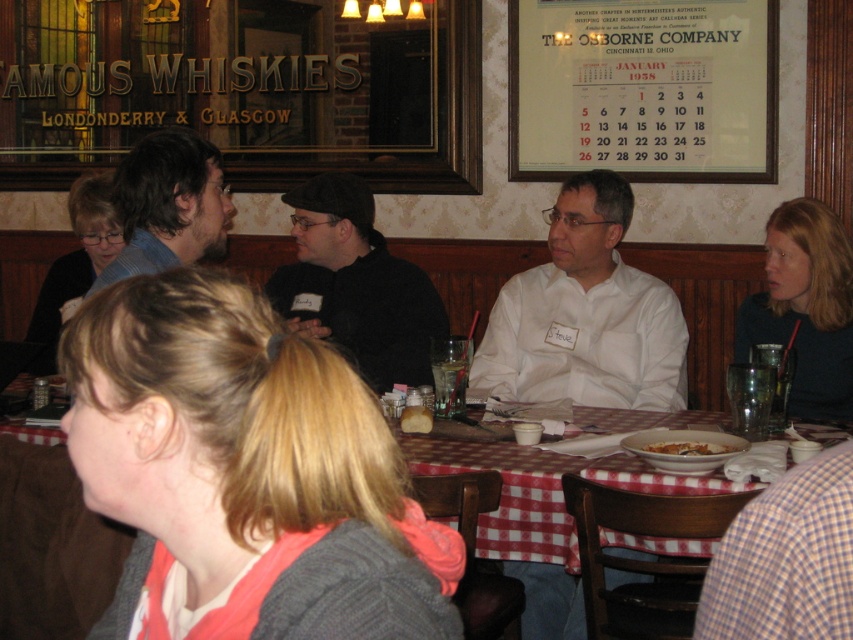
You are a server at the restaurant and need to deliver a drink to the customer with blonde hair at center. The table with red checkered tablecloth at center is between you and the customer. Can you reach the customer without moving the table?

The distance between the blonde hair at center and the red checkered tablecloth at center is 4.39 feet. Since the table is in the way, you would need to move around it or the table to reach the customer.

Based on the scene description, which object occupies more space in the image? The blonde hair at center or the red checkered tablecloth at center?

The red checkered tablecloth at center occupies more space in the image than the blonde hair at center.

You are a server at the restaurant and need to deliver a small appetizer plate to the table. The plate can only be placed between the white shirt at center and the black matte shirt at center. Is there enough space between them to place the plate?

The white shirt at center and the black matte shirt at center are 52.54 centimeters apart, so yes, there is enough space to place the small appetizer plate between them.